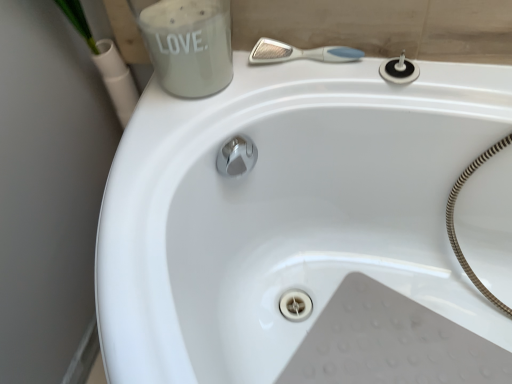
Question: From a real-world perspective, is white plastic shower at upper center over black rubber drain at upper right?

Choices:
 (A) yes
 (B) no

Answer: (A)

Question: Does white plastic shower at upper center appear on the right side of black rubber drain at upper right?

Choices:
 (A) yes
 (B) no

Answer: (B)

Question: Is white plastic shower at upper center taller than black rubber drain at upper right?

Choices:
 (A) no
 (B) yes

Answer: (A)

Question: Is black rubber drain at upper right inside white plastic shower at upper center?

Choices:
 (A) yes
 (B) no

Answer: (B)

Question: Is the depth of white plastic shower at upper center less than that of black rubber drain at upper right?

Choices:
 (A) yes
 (B) no

Answer: (B)

Question: Does white plastic shower at upper center turn towards black rubber drain at upper right?

Choices:
 (A) no
 (B) yes

Answer: (A)

Question: Could you tell me if black rubber drain at upper right is facing white frosted glass jar at upper left?

Choices:
 (A) yes
 (B) no

Answer: (B)

Question: Can you confirm if black rubber drain at upper right is wider than white frosted glass jar at upper left?

Choices:
 (A) no
 (B) yes

Answer: (A)

Question: Is black rubber drain at upper right with white frosted glass jar at upper left?

Choices:
 (A) yes
 (B) no

Answer: (B)

Question: Is black rubber drain at upper right surrounding white frosted glass jar at upper left?

Choices:
 (A) yes
 (B) no

Answer: (B)

Question: Does black rubber drain at upper right appear on the left side of white frosted glass jar at upper left?

Choices:
 (A) no
 (B) yes

Answer: (A)

Question: Is black rubber drain at upper right smaller than white frosted glass jar at upper left?

Choices:
 (A) no
 (B) yes

Answer: (B)

Question: Is the position of white frosted glass jar at upper left less distant than that of white plastic shower at upper center?

Choices:
 (A) yes
 (B) no

Answer: (A)